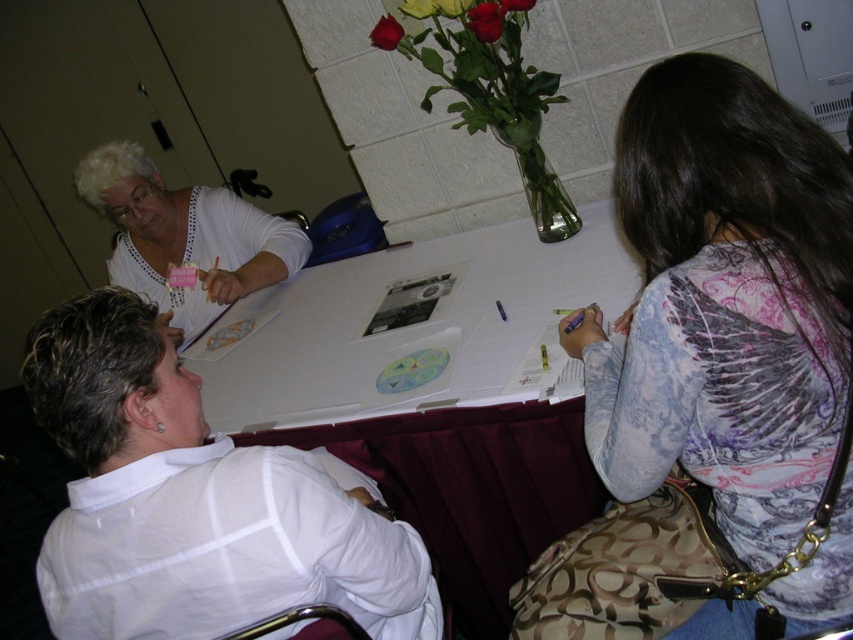
Question: Which object is farther from the camera taking this photo?

Choices:
 (A) white paper at center
 (B) white dotted blouse at upper left
 (C) white matte shirt at lower left
 (D) printed fabric shirt at right

Answer: (B)

Question: Which is farther from the white matte shirt at lower left?

Choices:
 (A) printed fabric shirt at right
 (B) white paper at center
 (C) white dotted blouse at upper left

Answer: (C)

Question: Considering the relative positions of white paper at center and white matte shirt at lower left in the image provided, where is white paper at center located with respect to white matte shirt at lower left?

Choices:
 (A) right
 (B) left

Answer: (A)

Question: Which point appears farthest from the camera in this image?

Choices:
 (A) (84, 627)
 (B) (387, 413)

Answer: (B)

Question: Does printed fabric shirt at right have a greater width compared to white paper at center?

Choices:
 (A) yes
 (B) no

Answer: (B)

Question: Does printed fabric shirt at right have a lesser width compared to white dotted blouse at upper left?

Choices:
 (A) no
 (B) yes

Answer: (B)